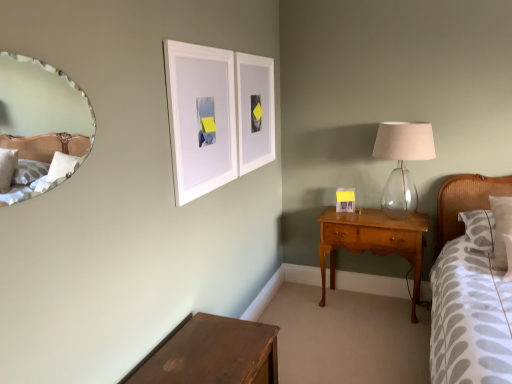
What are the coordinates of `free location to the right of matte white picture frame at right, which is the 1th picture frame in back-to-front order` in the screenshot? It's located at (371, 213).